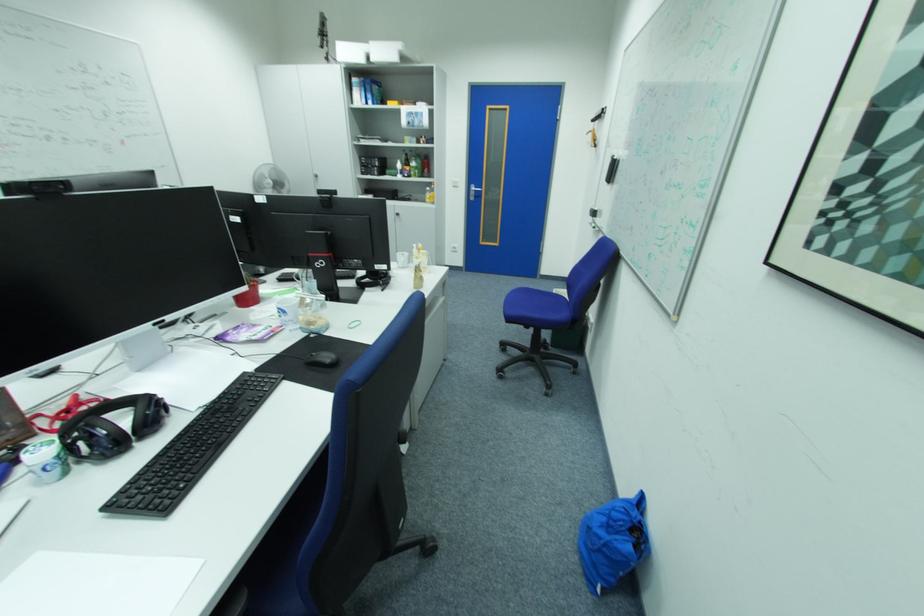
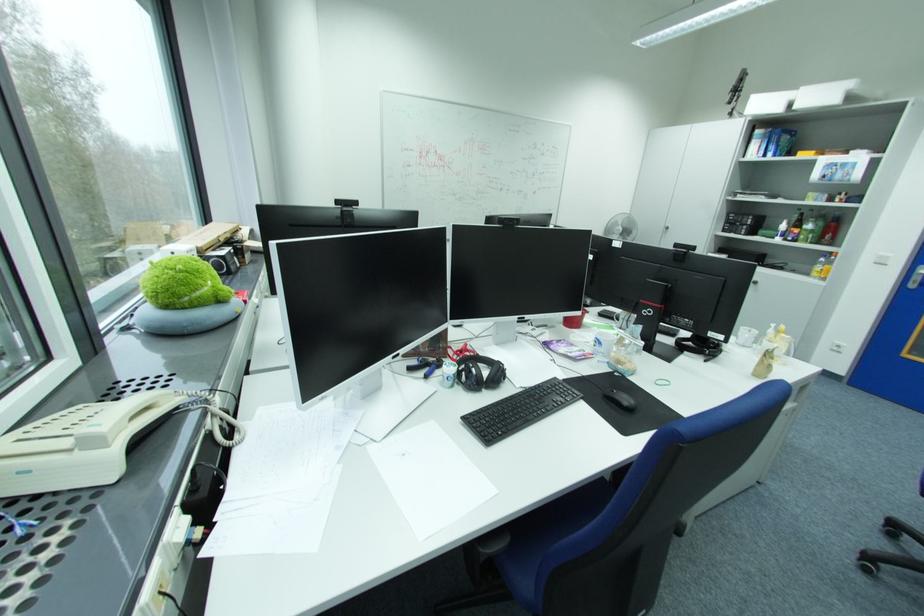
In the second image, find the point that corresponds to point (411, 260) in the first image.

(756, 336)